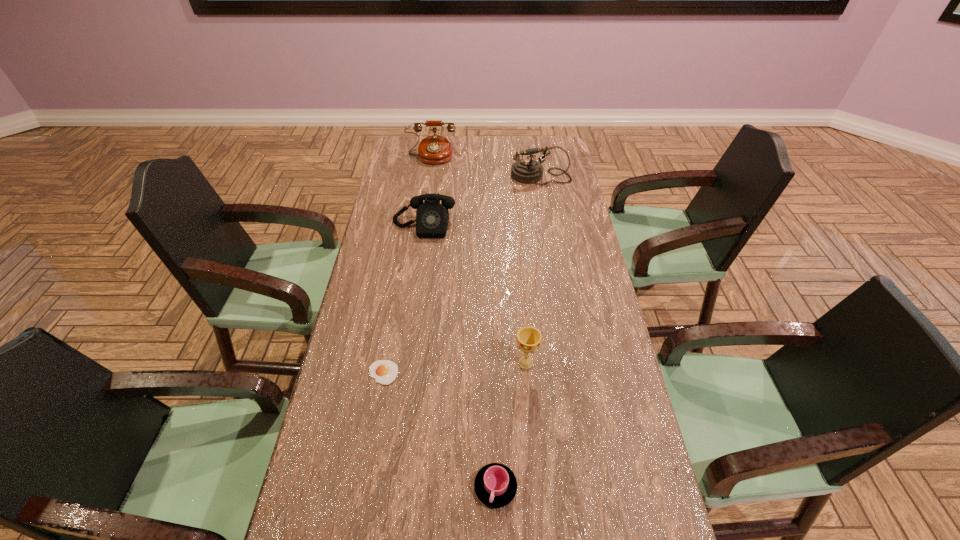
You are a GUI agent. You are given a task and a screenshot of the screen. Output one action in this format:
    pyautogui.click(x=<x>, y=<y>)
    Task: Click on the free space at the left edge of the desktop
    The width and height of the screenshot is (960, 540).
    Given the screenshot: What is the action you would take?
    pyautogui.click(x=356, y=445)

This screenshot has height=540, width=960. Identify the location of vacant region at the right edge of the desktop. (632, 453).

At what (x,y) coordinates should I click in order to perform the action: click on free spot at the far left corner of the desktop. Please return your answer as a coordinate pair (x, y). Looking at the image, I should click on (414, 156).

The image size is (960, 540). I want to click on vacant space at the far right corner of the desktop, so click(547, 140).

I want to click on free space between the shortest object and the chalice, so click(455, 368).

Where is `vacant space that is in between the farthest telephone and the second shortest object`? The width and height of the screenshot is (960, 540). vacant space that is in between the farthest telephone and the second shortest object is located at coordinates pyautogui.click(x=463, y=321).

The width and height of the screenshot is (960, 540). I want to click on vacant point located between the shortest object and the farthest telephone, so click(x=407, y=264).

This screenshot has height=540, width=960. In order to click on free area in between the farthest telephone and the chalice in this screenshot , I will do `click(478, 260)`.

Find the location of a particular element. This screenshot has height=540, width=960. free spot between the shortest telephone and the second farthest telephone is located at coordinates (482, 201).

What are the coordinates of `blank region between the nearest object and the farthest object` in the screenshot? It's located at (463, 321).